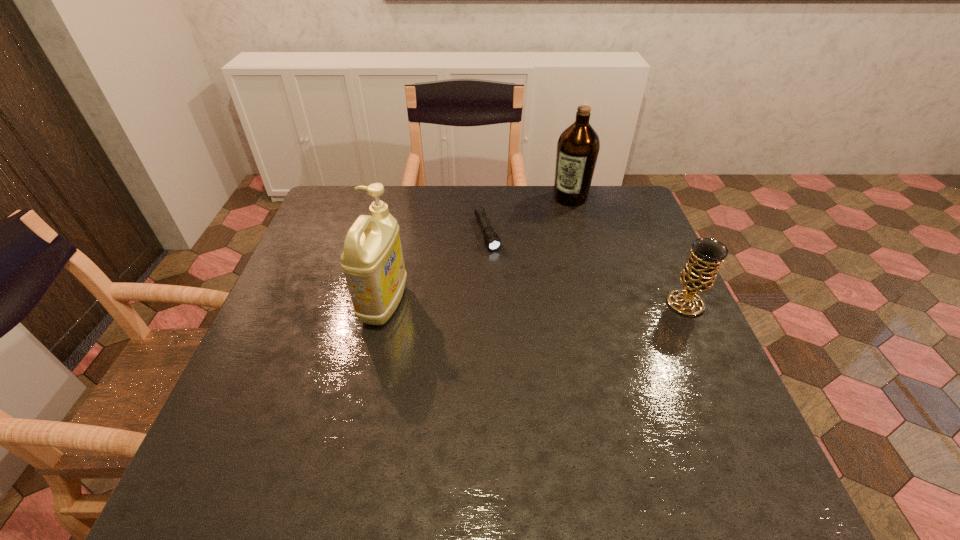
The width and height of the screenshot is (960, 540). Identify the location of vacant space on the desktop that is between the leftmost object and the chalice and is positioned at the lens end of the third nearest object. (518, 304).

Locate an element on the screen. This screenshot has height=540, width=960. vacant space on the desktop that is between the detergent and the chalice and is positioned on the label of the olive oil is located at coordinates (492, 304).